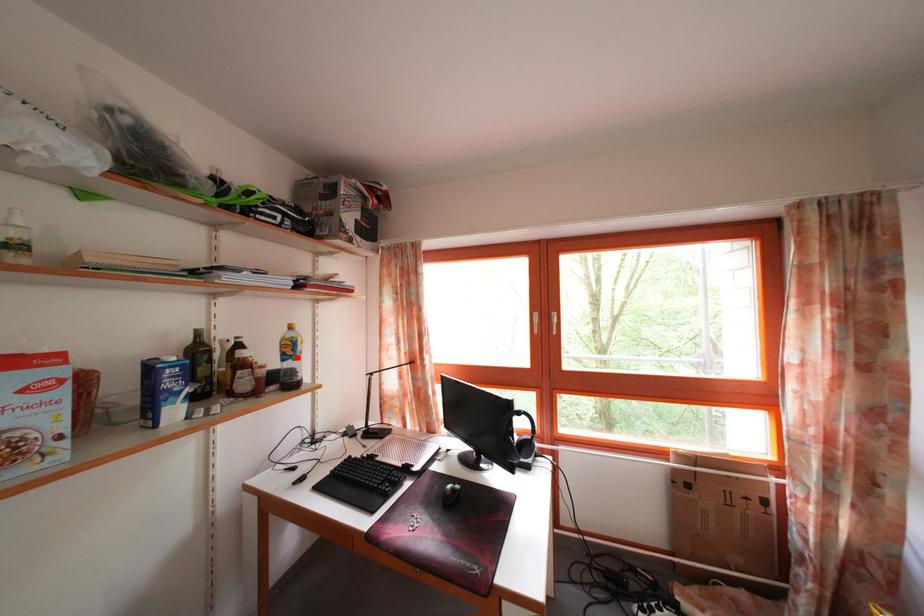
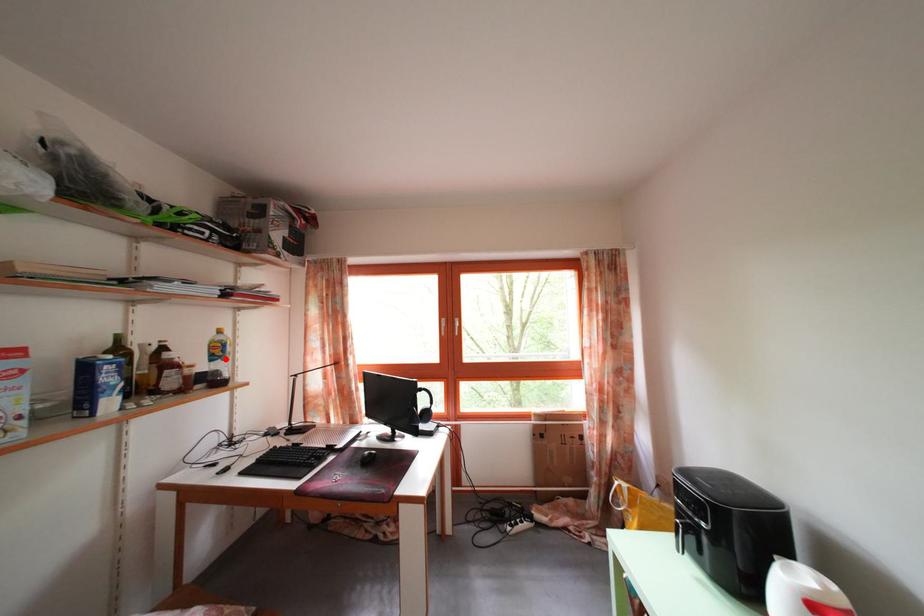
I am providing you with two images of the same scene from different viewpoints. A red point is marked on the first image and another point is marked on the second image. Does the point marked in image1 correspond to the same location as the one in image2?

Yes